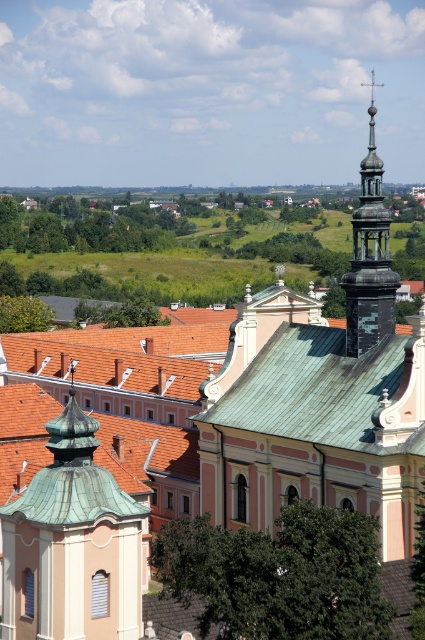
Question: Observing the image, what is the correct spatial positioning of green copper dome at center in reference to green metal roof at center?

Choices:
 (A) left
 (B) right

Answer: (A)

Question: Is green copper dome at center wider than shiny copper spire at upper right?

Choices:
 (A) no
 (B) yes

Answer: (A)

Question: Which of these objects is positioned closest to the shiny copper spire at upper right?

Choices:
 (A) green metal roof at center
 (B) green copper dome at center

Answer: (A)

Question: Based on their relative distances, which object is nearer to the green copper dome at center?

Choices:
 (A) shiny copper spire at upper right
 (B) green metal roof at center

Answer: (B)

Question: Is the position of green metal roof at center more distant than that of shiny copper spire at upper right?

Choices:
 (A) yes
 (B) no

Answer: (B)

Question: Which object is the farthest from the green copper dome at center?

Choices:
 (A) green metal roof at center
 (B) shiny copper spire at upper right

Answer: (B)